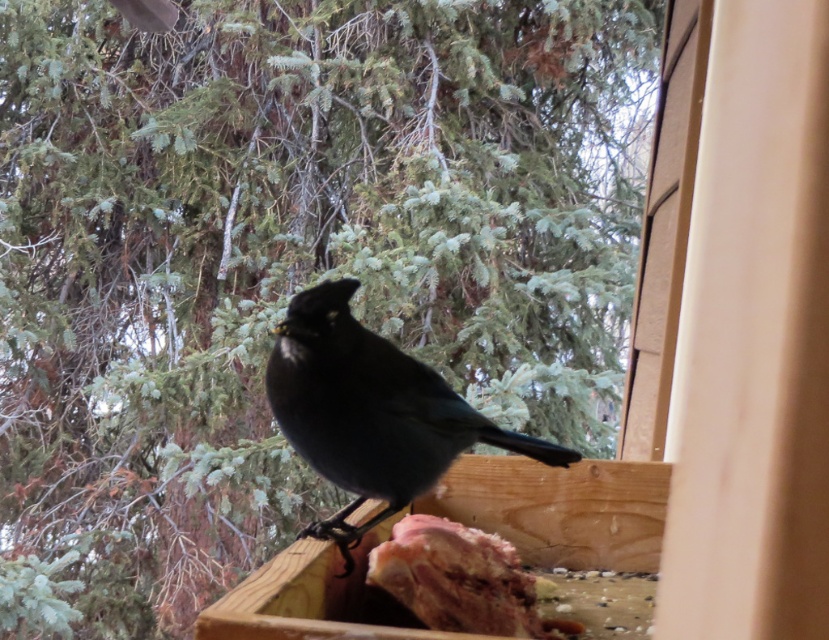
Can you confirm if shiny black bird at center is positioned to the right of raw meat at center?

Incorrect, shiny black bird at center is not on the right side of raw meat at center.

Can you confirm if shiny black bird at center is positioned below raw meat at center?

Incorrect, shiny black bird at center is not positioned below raw meat at center.

Between point (304, 410) and point (420, 588), which one is positioned behind?

The point (420, 588) is behind.

What are the coordinates of `shiny black bird at center` in the screenshot? It's located at (371, 412).